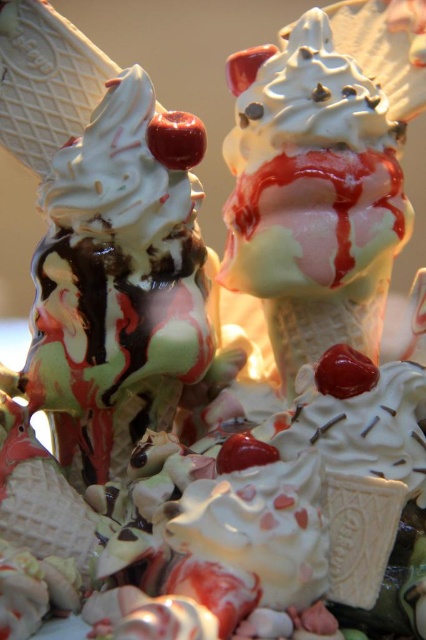
You are an ice cream vendor and need to place a cherry on top of the swirled vanilla ice cream at center. According to the coordinates provided, where exactly should you place the cherry?

The cherry should be placed at the coordinates point (117, 292) where the swirled vanilla ice cream at center is located.

You are at an ice cream shop and want to choose between the swirled vanilla ice cream at center and the white chocolate ice cream cone at center. Based on their sizes, which one is more likely to spill if you walk quickly?

The swirled vanilla ice cream at center is thinner than the white chocolate ice cream cone at center, so it is more likely to spill if you walk quickly because it has a smaller volume and may not be as securely held in place.